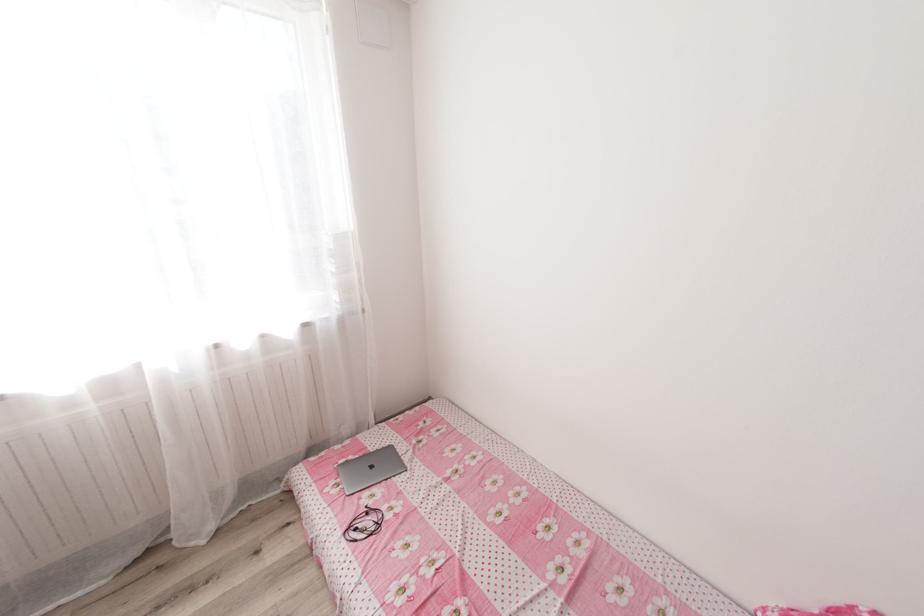
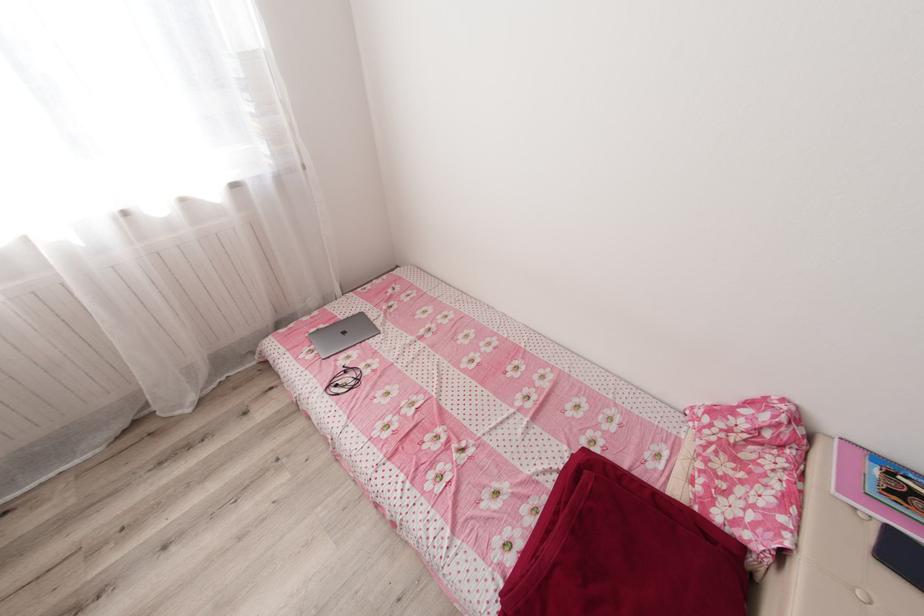
Where in the second image is the point corresponding to point (395, 448) from the first image?

(367, 315)